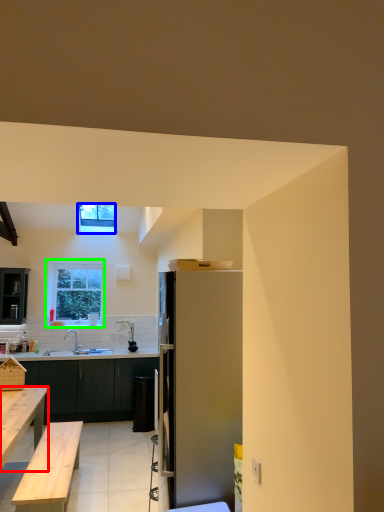
Question: Which is nearer to the desk (highlighted by a red box)? window (highlighted by a blue box) or window (highlighted by a green box).

Choices:
 (A) window
 (B) window

Answer: (B)